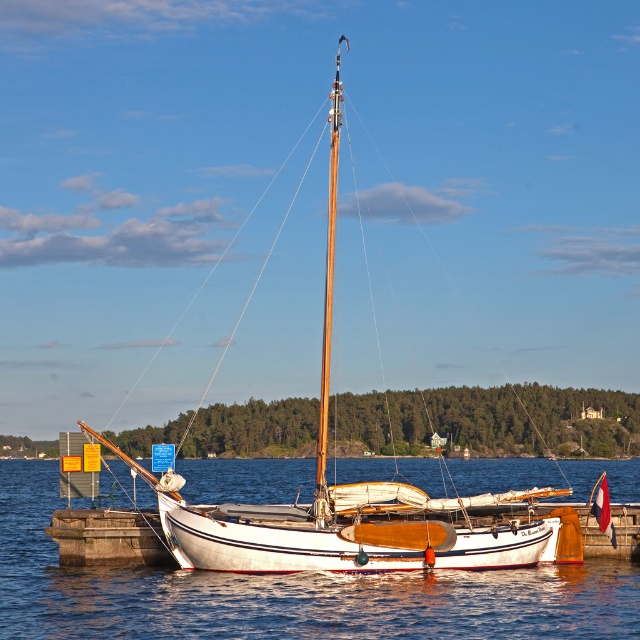
You are a sailor planning to anchor your boat in the area shown in the image. You see the white smooth water at center and the white wood sailboat at center. Which area would you choose to anchor your boat, and why?

You should anchor your boat in the area with the white smooth water at center because it has a smaller size compared to the white wood sailboat at center, making it a calmer and safer spot for anchoring.

You are standing on the pier and want to estimate how far the white smooth water at center is from you. Based on the scene, what is the approximate distance in meters?

The white smooth water at center is approximately 29.37 meters away from the viewer.